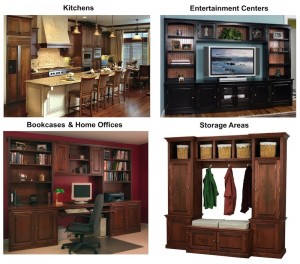
The width and height of the screenshot is (300, 264). Find the location of `books`. books is located at coordinates (121, 166), (123, 155).